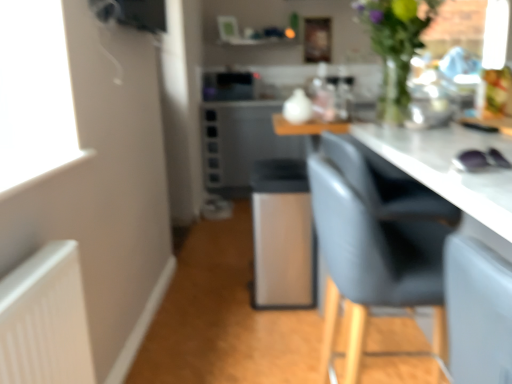
You are a GUI agent. You are given a task and a screenshot of the screen. Output one action in this format:
    pyautogui.click(x=<x>, y=<y>)
    Task: Click on the unoccupied area in front of satin silver bar stool at center
    This screenshot has height=384, width=512.
    Given the screenshot: What is the action you would take?
    pyautogui.click(x=257, y=328)